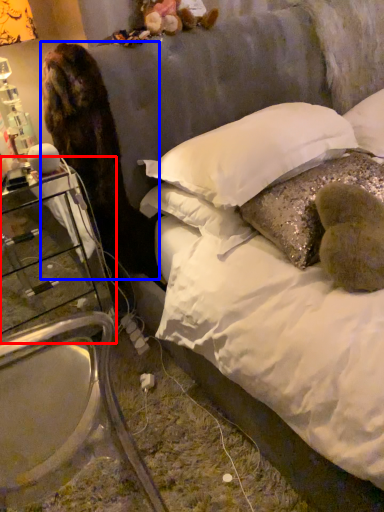
Question: Which of the following is the closest to the observer, nightstand (highlighted by a red box) or animal (highlighted by a blue box)?

Choices:
 (A) nightstand
 (B) animal

Answer: (B)